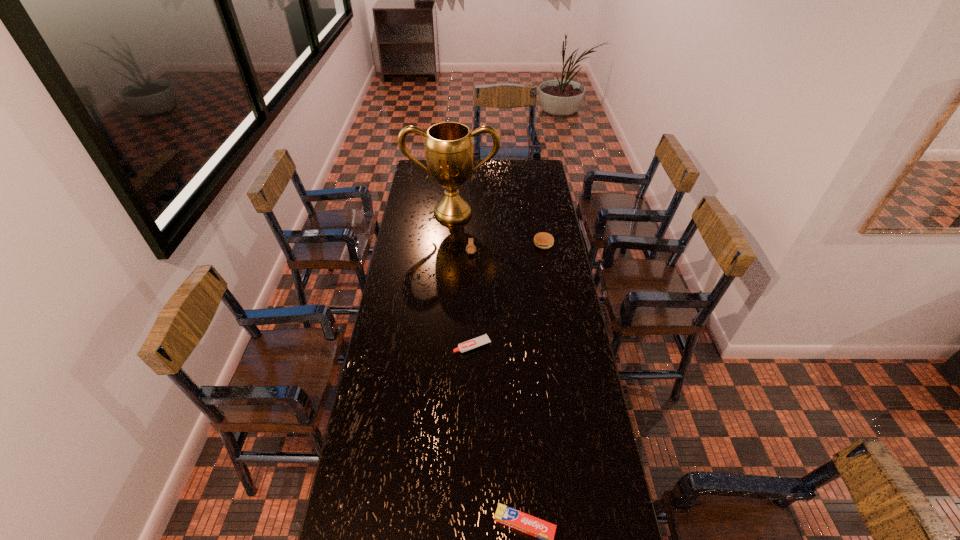
Where is `object that is positioned at the left edge`? object that is positioned at the left edge is located at coordinates (449, 146).

At what (x,y) coordinates should I click in order to perform the action: click on object that is positioned at the right edge. Please return your answer as a coordinate pair (x, y). The height and width of the screenshot is (540, 960). Looking at the image, I should click on (543, 240).

Where is `free space at the left edge of the desktop`? This screenshot has height=540, width=960. free space at the left edge of the desktop is located at coordinates (390, 348).

Image resolution: width=960 pixels, height=540 pixels. Identify the location of vacant space at the right edge of the desktop. (558, 332).

Where is `vacant area at the far right corner of the desktop`? The width and height of the screenshot is (960, 540). vacant area at the far right corner of the desktop is located at coordinates (550, 178).

Where is `vacant space that's between the trophy cup and the third shortest object`? This screenshot has width=960, height=540. vacant space that's between the trophy cup and the third shortest object is located at coordinates (498, 228).

Image resolution: width=960 pixels, height=540 pixels. Find the location of `free space between the second tallest object and the trophy cup`. free space between the second tallest object and the trophy cup is located at coordinates (462, 233).

At what (x,y) coordinates should I click in order to perform the action: click on free spot between the second tallest object and the rightmost object. Please return your answer as a coordinate pair (x, y). This screenshot has width=960, height=540. Looking at the image, I should click on (507, 248).

The image size is (960, 540). Find the location of `vacant area that lies between the watch and the tallest object`. vacant area that lies between the watch and the tallest object is located at coordinates (462, 233).

What are the coordinates of `vacant space that is in between the rightmost object and the trophy cup` in the screenshot? It's located at (498, 228).